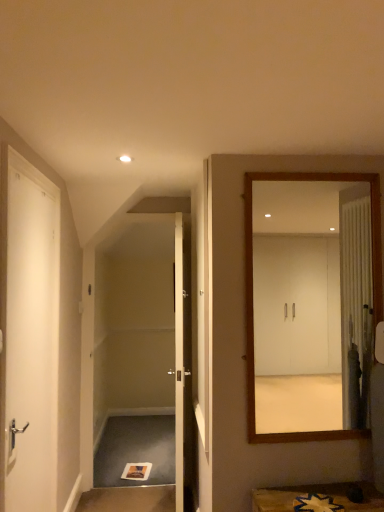
Question: Does carpeted stair at lower left have a smaller size compared to white glossy door at center, which is the second door from left to right?

Choices:
 (A) no
 (B) yes

Answer: (B)

Question: Considering the relative sizes of carpeted stair at lower left and white glossy door at center, the 2th door viewed from the front, in the image provided, is carpeted stair at lower left taller than white glossy door at center, the 2th door viewed from the front,?

Choices:
 (A) yes
 (B) no

Answer: (B)

Question: Is carpeted stair at lower left to the right of white glossy door at center, the 2th door viewed from the front, from the viewer's perspective?

Choices:
 (A) no
 (B) yes

Answer: (A)

Question: Is carpeted stair at lower left behind white glossy door at center, which is the second door from left to right?

Choices:
 (A) no
 (B) yes

Answer: (B)

Question: Is carpeted stair at lower left with white glossy door at center, which is the second door from left to right?

Choices:
 (A) yes
 (B) no

Answer: (B)

Question: Are carpeted stair at lower left and white glossy door at center, which appears as the 1th door when viewed from the right, far apart?

Choices:
 (A) no
 (B) yes

Answer: (A)

Question: Is white glossy door at center, which is the second door from left to right, further to the viewer compared to carpeted stair at lower left?

Choices:
 (A) yes
 (B) no

Answer: (B)

Question: Is carpeted stair at lower left at the back of white glossy door at center, which is the second door from left to right?

Choices:
 (A) no
 (B) yes

Answer: (A)

Question: Considering the relative sizes of white glossy door at center, which is the second door from left to right, and carpeted stair at lower left in the image provided, is white glossy door at center, which is the second door from left to right, taller than carpeted stair at lower left?

Choices:
 (A) no
 (B) yes

Answer: (B)

Question: Is white glossy door at center, which is the second door from left to right, facing towards carpeted stair at lower left?

Choices:
 (A) yes
 (B) no

Answer: (A)

Question: From the image's perspective, is white glossy door at center, the 2th door viewed from the front, below carpeted stair at lower left?

Choices:
 (A) yes
 (B) no

Answer: (B)

Question: From a real-world perspective, is white glossy door at center, the first door positioned from the back, physically below carpeted stair at lower left?

Choices:
 (A) yes
 (B) no

Answer: (B)

Question: Is white glossy door at center, the 2th door viewed from the front, surrounding wooden mirror at right?

Choices:
 (A) yes
 (B) no

Answer: (B)